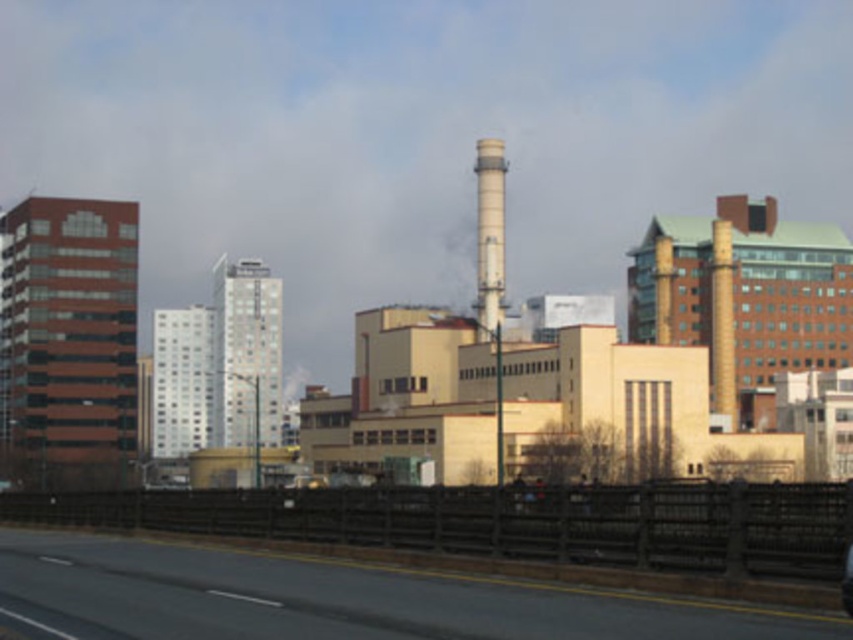
You are a delivery driver approaching the industrial area. You need to know if the shiny black car at center is taller than the white smooth chimney at center to plan your route. Can you confirm?

The white smooth chimney at center is taller than the shiny black car at center, so the car is not taller than the chimney.

You are a delivery driver planning to turn left onto a side street located at the point marked by the coordinates point (334, 600). Based on the scene, what type of road will you be turning onto?

The point (334, 600) corresponds to the black asphalt highway at lower center, so turning left onto this road would lead you onto a highway.

You are a delivery driver who needs to make a U turn on the black asphalt highway at lower center. Can you safely complete the U turn without crossing the shiny black car at center?

The black asphalt highway at lower center might be wider than shiny black car at center, so it is possible to make a U turn without crossing the shiny black car at center, but you need to ensure there is enough space and no oncoming traffic.